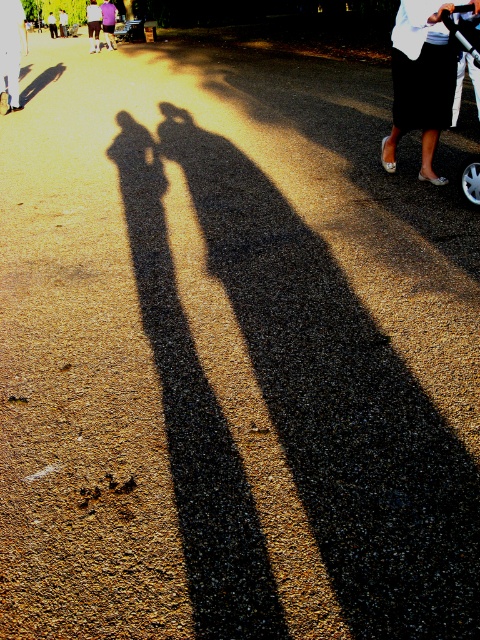
You are a photographer trying to capture the shadows of two people wearing a black satin skirt at upper right and a white cotton shirt at center. Which clothing item casts a wider shadow?

The white cotton shirt at center casts a wider shadow than the black satin skirt at upper right because the black satin skirt at upper right has a lesser width compared to white cotton shirt at center.

Based on the photo, you are standing at the point with coordinates point (91, 36) and want to walk towards the point with coordinates point (410, 33). Which direction should you face to move directly towards it?

You should face north because point (410, 33) is in front of point (91, 36).

You are a photographer trying to capture the shadows of the white plastic baby carriage at upper right and the purple cotton shirt at upper left. Which object casts a longer shadow?

The purple cotton shirt at upper left casts a longer shadow since it is taller than the white plastic baby carriage at upper right.